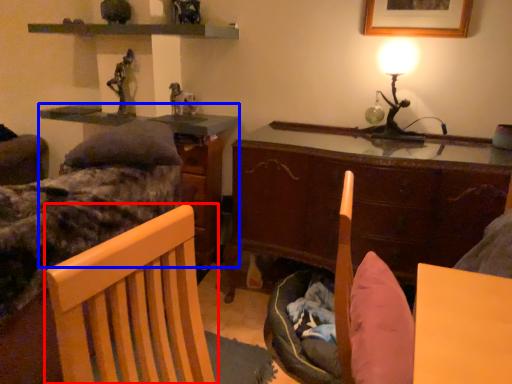
Question: Which of the following is the closest to the observer, chair (highlighted by a red box) or table (highlighted by a blue box)?

Choices:
 (A) chair
 (B) table

Answer: (A)